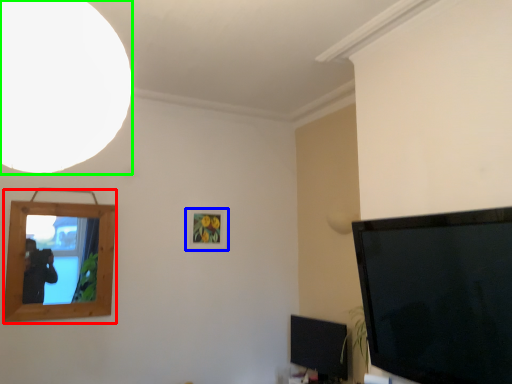
Question: Which object is positioned closest to picture frame (highlighted by a red box)? Select from picture frame (highlighted by a blue box) and light (highlighted by a green box).

Choices:
 (A) picture frame
 (B) light

Answer: (A)